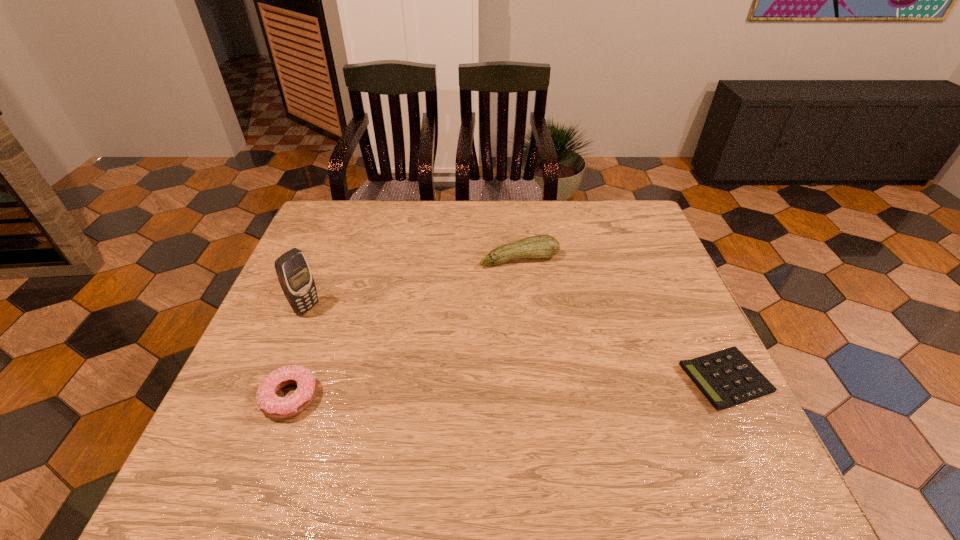
Where is `free point that satisfies the following two spatial constraints: 1. on the front side of the cellular telephone; 2. on the right side of the doughnut`? The image size is (960, 540). free point that satisfies the following two spatial constraints: 1. on the front side of the cellular telephone; 2. on the right side of the doughnut is located at coordinates (271, 397).

Locate an element on the screen. Image resolution: width=960 pixels, height=540 pixels. free spot that satisfies the following two spatial constraints: 1. on the back side of the cellular telephone; 2. on the left side of the second tallest object is located at coordinates (326, 259).

Locate an element on the screen. vacant space that satisfies the following two spatial constraints: 1. on the back side of the third tallest object; 2. on the right side of the shortest object is located at coordinates (297, 379).

The width and height of the screenshot is (960, 540). In order to click on vacant region that satisfies the following two spatial constraints: 1. on the back side of the zucchini; 2. on the right side of the third nearest object in this screenshot , I will do `click(326, 259)`.